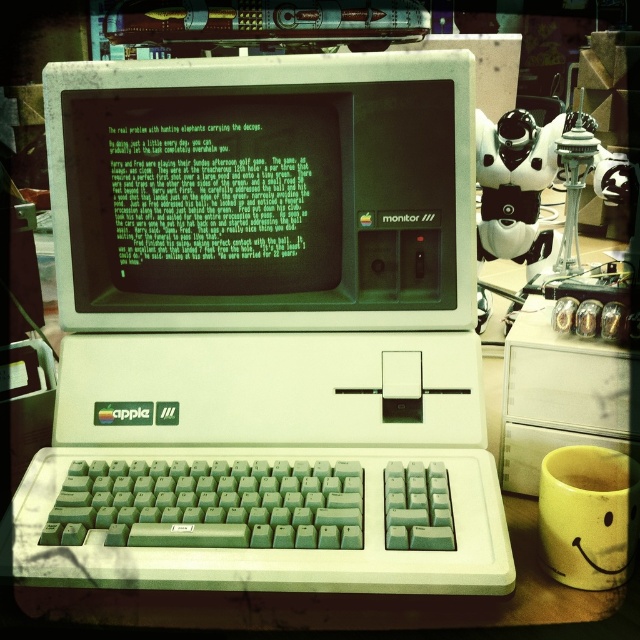
Does white plastic apple iii monitor at center appear under matte white monitor at center?

Indeed, white plastic apple iii monitor at center is positioned under matte white monitor at center.

Is point (296, 240) less distant than point (113, 236)?

That is True.

Is point (304, 140) positioned in front of point (340, 122)?

No, (304, 140) is behind (340, 122).

Where is `white plastic apple iii monitor at center`? The image size is (640, 640). white plastic apple iii monitor at center is located at coordinates (264, 332).

Is matte white monitor at center smaller than yellow matte mug at lower right?

No.

Identify the location of matte white monitor at center. (262, 193).

Can you confirm if white plastic apple iii monitor at center is positioned to the right of yellow matte mug at lower right?

No, white plastic apple iii monitor at center is not to the right of yellow matte mug at lower right.

Does point (0, 536) lie behind point (628, 509)?

That is True.

You are a GUI agent. You are given a task and a screenshot of the screen. Output one action in this format:
    pyautogui.click(x=<x>, y=<y>)
    Task: Click on the white plastic apple iii monitor at center
    This screenshot has height=640, width=640.
    Given the screenshot: What is the action you would take?
    pyautogui.click(x=264, y=332)